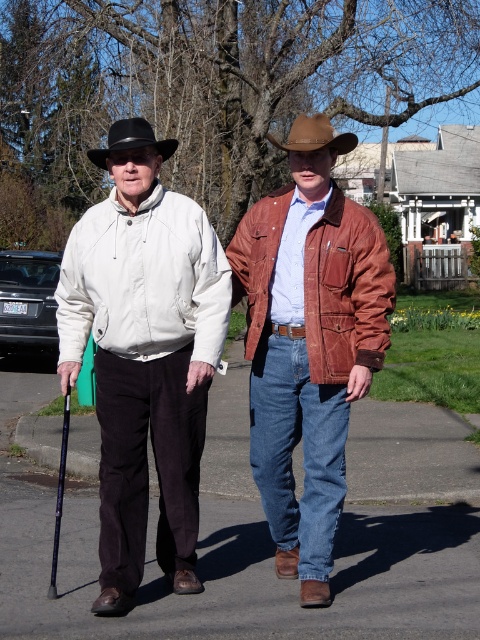
Question: Based on their relative distances, which object is nearer to the brown leather cowboy hat at center?

Choices:
 (A) suede brown jacket at center
 (B) black felt fedora at upper center
 (C) white matte jacket at center

Answer: (B)

Question: Is white matte jacket at center thinner than black felt fedora at upper center?

Choices:
 (A) no
 (B) yes

Answer: (B)

Question: Considering the real-world distances, which object is farthest from the suede brown jacket at center?

Choices:
 (A) white matte jacket at center
 (B) black felt fedora at upper center

Answer: (B)

Question: Does brown leather cowboy hat at center have a lesser width compared to black felt fedora at upper center?

Choices:
 (A) yes
 (B) no

Answer: (A)

Question: Can you confirm if suede brown jacket at center is thinner than black felt fedora at upper center?

Choices:
 (A) no
 (B) yes

Answer: (B)

Question: Among these points, which one is nearest to the camera?

Choices:
 (A) (288, 138)
 (B) (310, 356)
 (C) (166, 154)

Answer: (B)